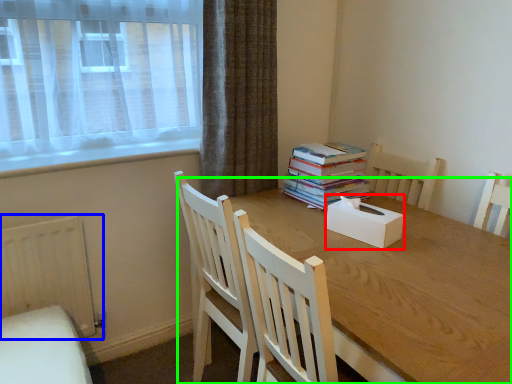
Question: Which object is the farthest from box (highlighted by a red box)? Choose among these: radiator (highlighted by a blue box) or round table (highlighted by a green box).

Choices:
 (A) radiator
 (B) round table

Answer: (A)